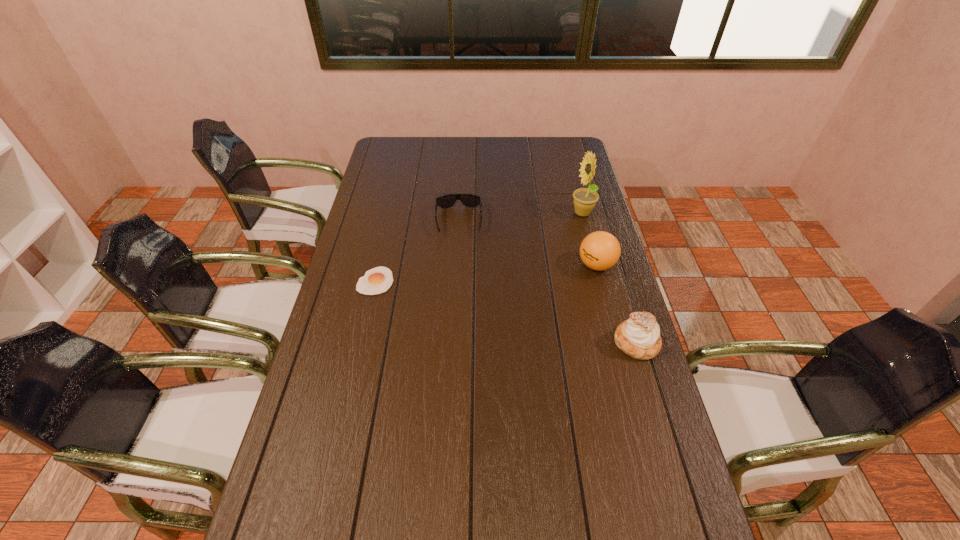
You are a GUI agent. You are given a task and a screenshot of the screen. Output one action in this format:
    pyautogui.click(x=<x>, y=<y>)
    Task: Click on the ping-pong ball that is at the right edge
    The height and width of the screenshot is (540, 960).
    Given the screenshot: What is the action you would take?
    pyautogui.click(x=600, y=250)

Where is `sunflower at the right edge`? sunflower at the right edge is located at coordinates tap(585, 199).

In the image, there is a desktop. Where is `vacant space at the far edge`? vacant space at the far edge is located at coordinates point(502,143).

You are a GUI agent. You are given a task and a screenshot of the screen. Output one action in this format:
    pyautogui.click(x=<x>, y=<y>)
    Task: Click on the free space at the left edge of the desktop
    
    Given the screenshot: What is the action you would take?
    coord(370,235)

In the image, there is a desktop. Where is `vacant space at the right edge`? The width and height of the screenshot is (960, 540). vacant space at the right edge is located at coordinates (615, 417).

Locate an element on the screen. The height and width of the screenshot is (540, 960). free space at the far right corner is located at coordinates (549, 145).

You are a GUI agent. You are given a task and a screenshot of the screen. Output one action in this format:
    pyautogui.click(x=<x>, y=<y>)
    Task: Click on the vacant area between the nearest object and the sunflower
    This screenshot has width=960, height=540.
    Given the screenshot: What is the action you would take?
    pyautogui.click(x=610, y=278)

Locate an element on the screen. Image resolution: width=960 pixels, height=540 pixels. empty space that is in between the shortest object and the sunglasses is located at coordinates (418, 251).

Find the location of `vacant area that lies between the fourth tallest object and the tallest object`. vacant area that lies between the fourth tallest object and the tallest object is located at coordinates (520, 218).

Where is `vacant area between the pastry and the tallest object`? The image size is (960, 540). vacant area between the pastry and the tallest object is located at coordinates (610, 278).